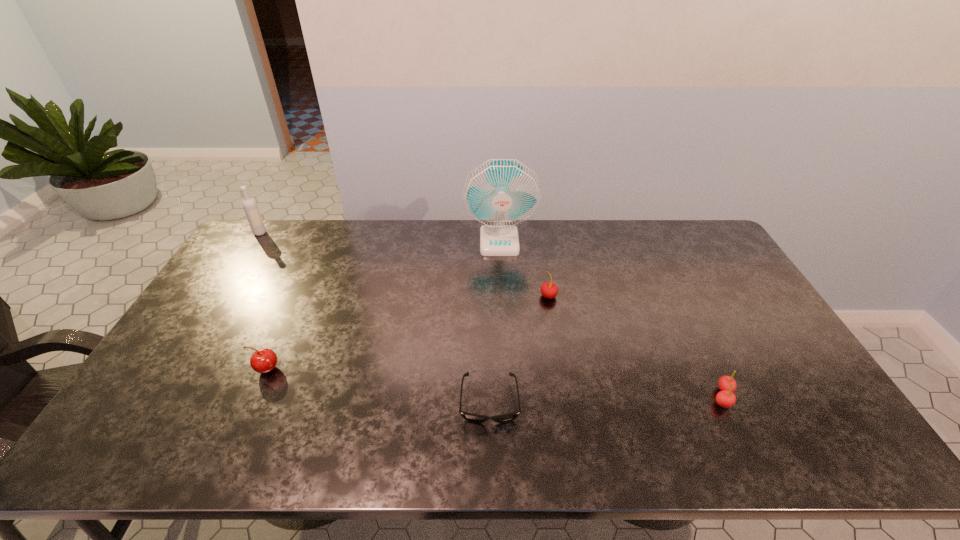
Select which cherry appears as the closest to the nearest cherry. Please provide its 2D coordinates. Your answer should be formatted as a tuple, i.e. [(x, y)], where the tuple contains the x and y coordinates of a point satisfying the conditions above.

[(549, 290)]

The width and height of the screenshot is (960, 540). Find the location of `vacant area that satisfies the following two spatial constraints: 1. in front of the fan to face the airflow; 2. on the left side of the fourth nearest object`. vacant area that satisfies the following two spatial constraints: 1. in front of the fan to face the airflow; 2. on the left side of the fourth nearest object is located at coordinates (502, 296).

Where is `vacant space that satisfies the following two spatial constraints: 1. in front of the fan to face the airflow; 2. on the right side of the rightmost cherry`? Image resolution: width=960 pixels, height=540 pixels. vacant space that satisfies the following two spatial constraints: 1. in front of the fan to face the airflow; 2. on the right side of the rightmost cherry is located at coordinates (508, 396).

This screenshot has width=960, height=540. Find the location of `vacant space that satisfies the following two spatial constraints: 1. on the front side of the nearest cherry; 2. on the left side of the fourth nearest object`. vacant space that satisfies the following two spatial constraints: 1. on the front side of the nearest cherry; 2. on the left side of the fourth nearest object is located at coordinates (565, 396).